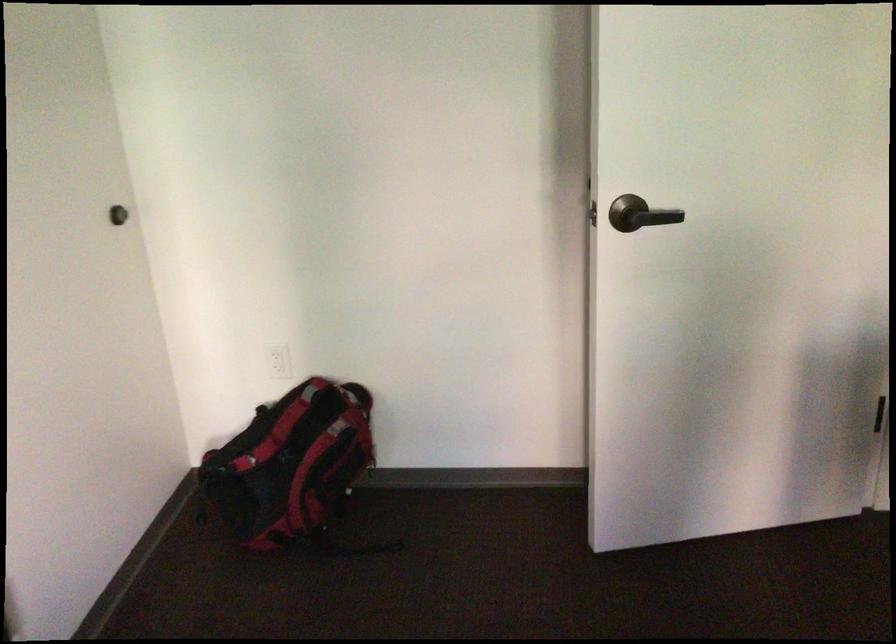
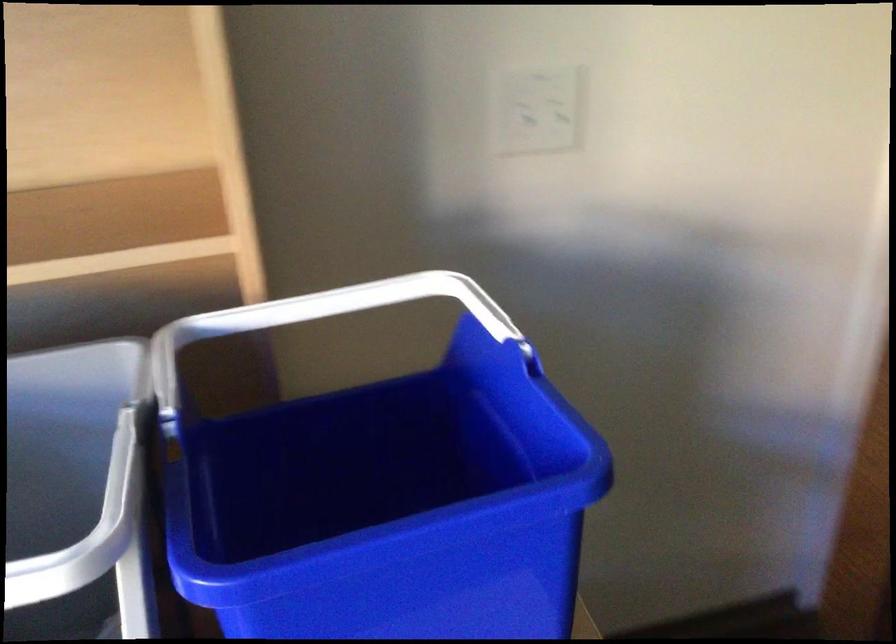
First-person continuous shooting, in which direction is the camera rotating?

The camera's rotation is toward left-down.